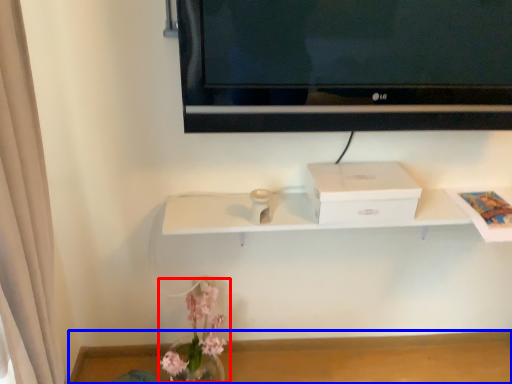
Question: Which object appears closest to the camera in this image, floral arrangement (highlighted by a red box) or table (highlighted by a blue box)?

Choices:
 (A) floral arrangement
 (B) table

Answer: (A)